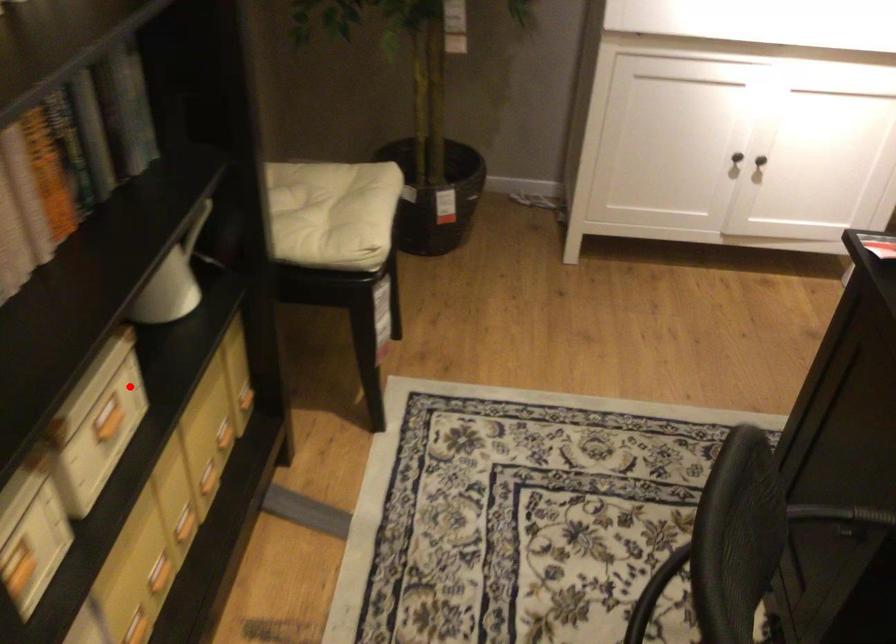
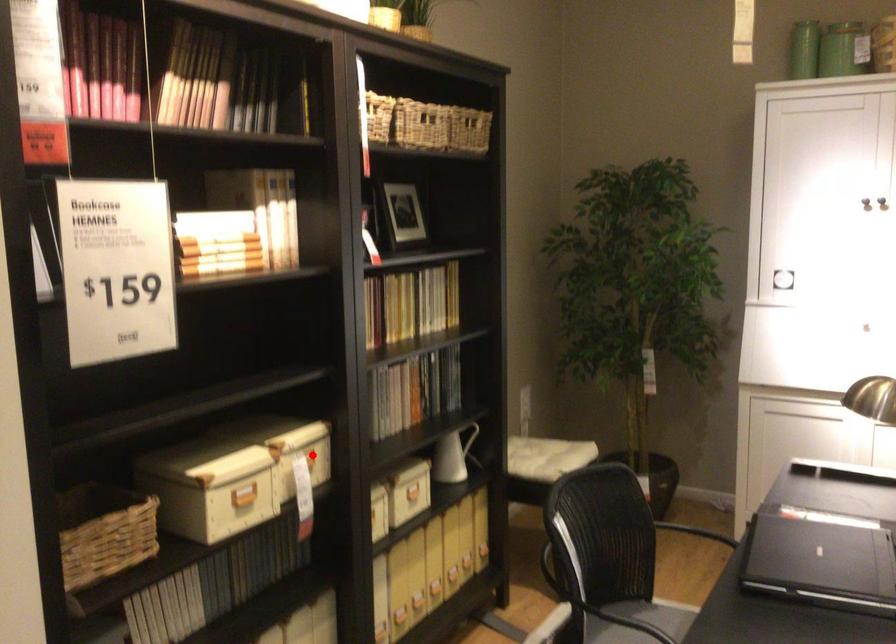
I am providing you with two images of the same scene from different viewpoints. A red point is marked on the first image and another point is marked on the second image. Are the points marked in image1 and image2 representing the same 3D position?

No